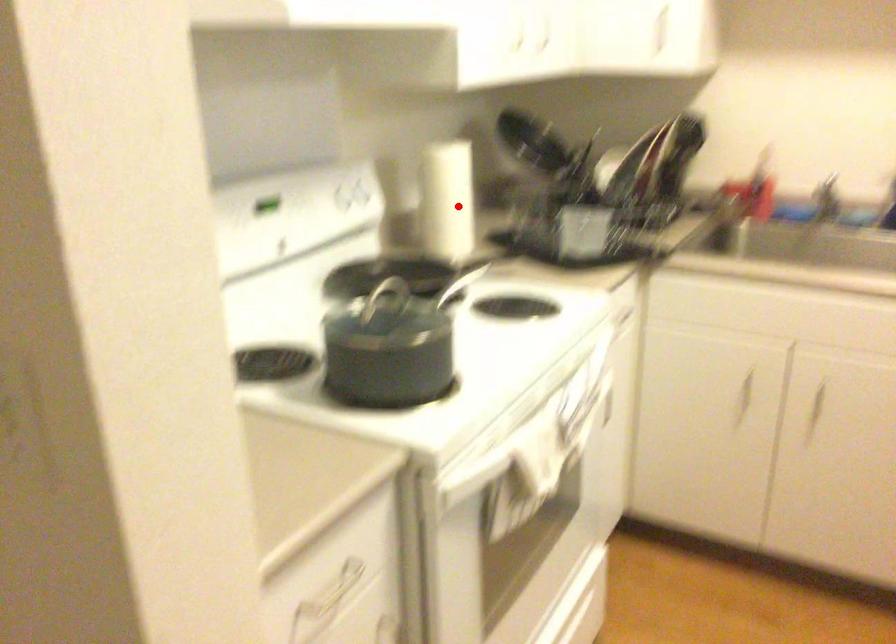
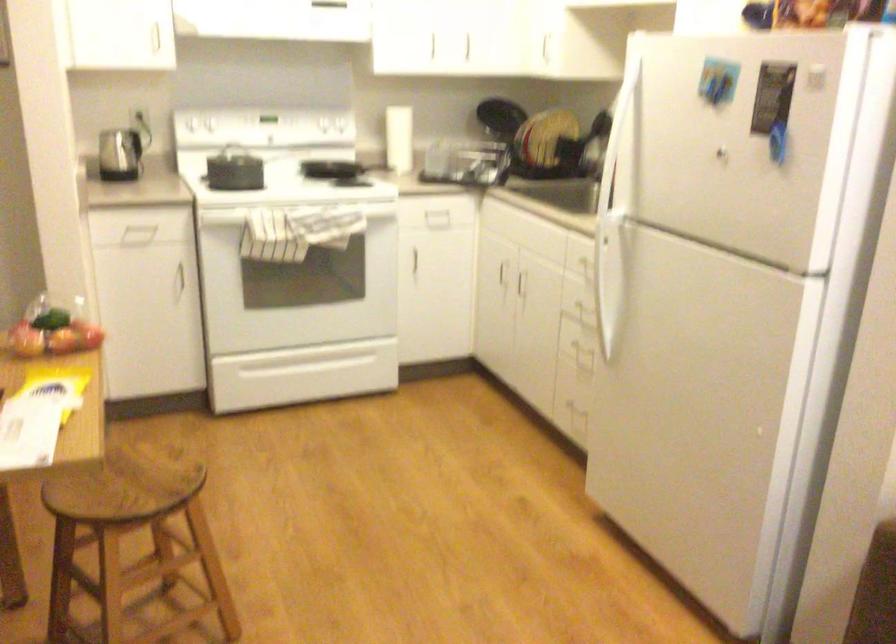
In the second image, find the point that corresponds to the highlighted location in the first image.

(399, 138)